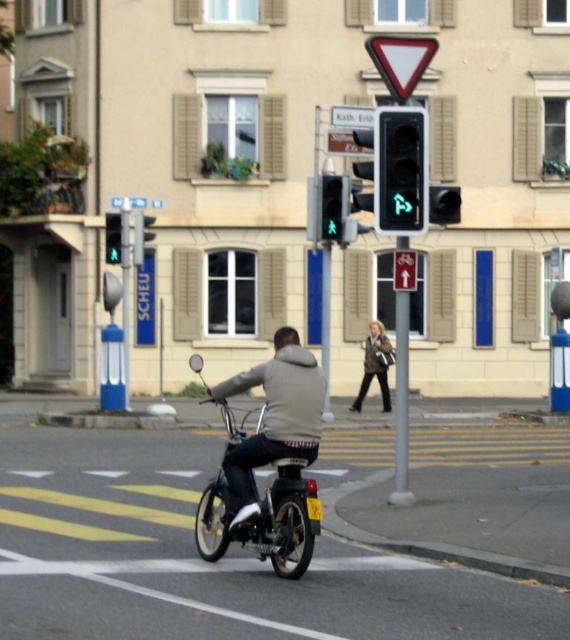
This screenshot has height=640, width=570. What do you see at coordinates (443, 204) in the screenshot?
I see `black plastic traffic light at upper right` at bounding box center [443, 204].

In the scene shown: Can you confirm if black plastic traffic light at upper right is taller than white plastic triangle at upper center?

No.

Measure the distance between point (x=449, y=221) and camera.

They are 13.27 meters apart.

In order to click on black plastic traffic light at upper right in this screenshot , I will do `click(443, 204)`.

Is the position of metallic reflective yield sign at upper center more distant than that of black plastic traffic light at upper right?

No.

The image size is (570, 640). In order to click on metallic reflective yield sign at upper center in this screenshot , I will do `click(401, 61)`.

Between point (392, 42) and point (453, 202), which one is positioned behind?

Point (453, 202)

Locate an element on the screen. This screenshot has width=570, height=640. metallic reflective yield sign at upper center is located at coordinates pyautogui.click(x=401, y=61).

Which is above, dark brown leather jacket at center or green glass pedestrian signal at upper center?

green glass pedestrian signal at upper center

Can you confirm if dark brown leather jacket at center is positioned below green glass pedestrian signal at upper center?

Yes.

Identify the location of dark brown leather jacket at center. The height and width of the screenshot is (640, 570). (376, 365).